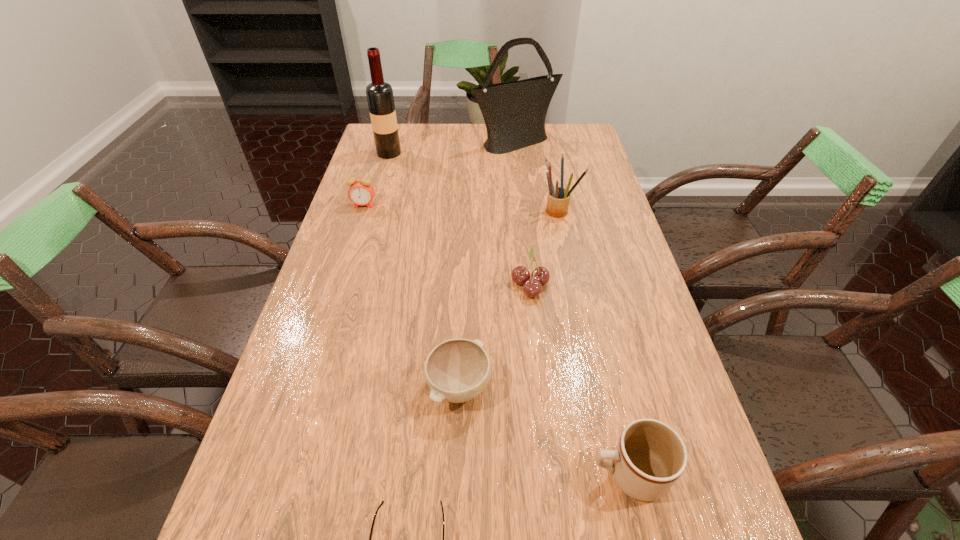
You are a GUI agent. You are given a task and a screenshot of the screen. Output one action in this format:
    pyautogui.click(x=<x>, y=<y>)
    Task: Click on the blank space at the right edge
    This screenshot has width=960, height=540.
    Given the screenshot: What is the action you would take?
    pyautogui.click(x=560, y=157)

This screenshot has height=540, width=960. Identify the location of free spot between the cherry and the wine bottle. (460, 219).

Find the location of a particular element. Image resolution: width=960 pixels, height=540 pixels. empty space between the shoulder bag and the cherry is located at coordinates (522, 213).

I want to click on vacant region between the alarm clock and the mug, so click(496, 339).

Identify the location of free space between the alarm clock and the seventh tallest object. The height and width of the screenshot is (540, 960). (411, 296).

Where is `free spot between the alarm clock and the fourth nearest object`? Image resolution: width=960 pixels, height=540 pixels. free spot between the alarm clock and the fourth nearest object is located at coordinates pyautogui.click(x=446, y=245).

This screenshot has width=960, height=540. Find the location of `free space that is in between the mug and the shoulder bag`. free space that is in between the mug and the shoulder bag is located at coordinates (572, 308).

Image resolution: width=960 pixels, height=540 pixels. Find the location of `free space that is in between the wine bottle and the fifth farthest object`. free space that is in between the wine bottle and the fifth farthest object is located at coordinates (460, 219).

Identify the location of free space between the alarm clock and the fifth farthest object. (446, 245).

Identify the location of unoccupied area between the pencil box and the alarm clock. The height and width of the screenshot is (540, 960). (462, 207).